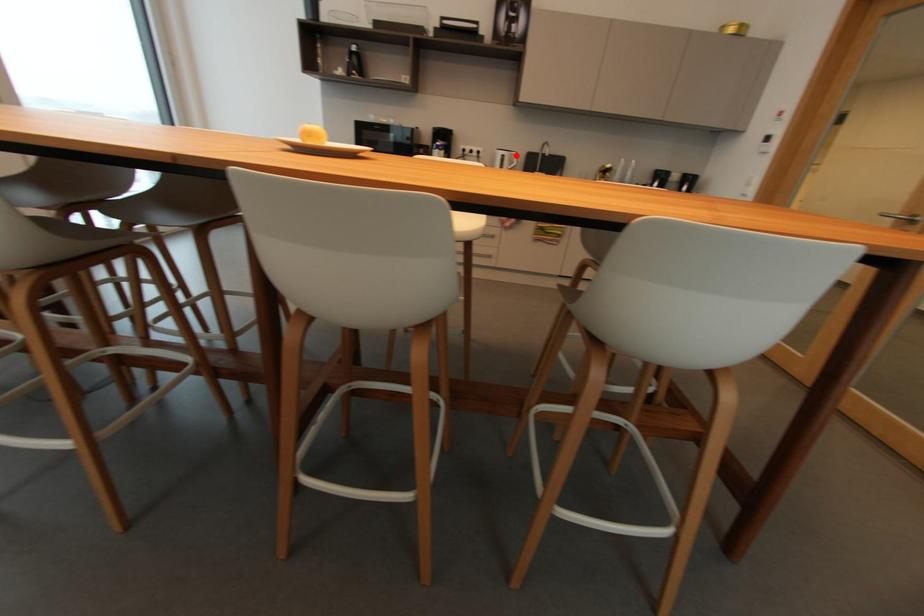
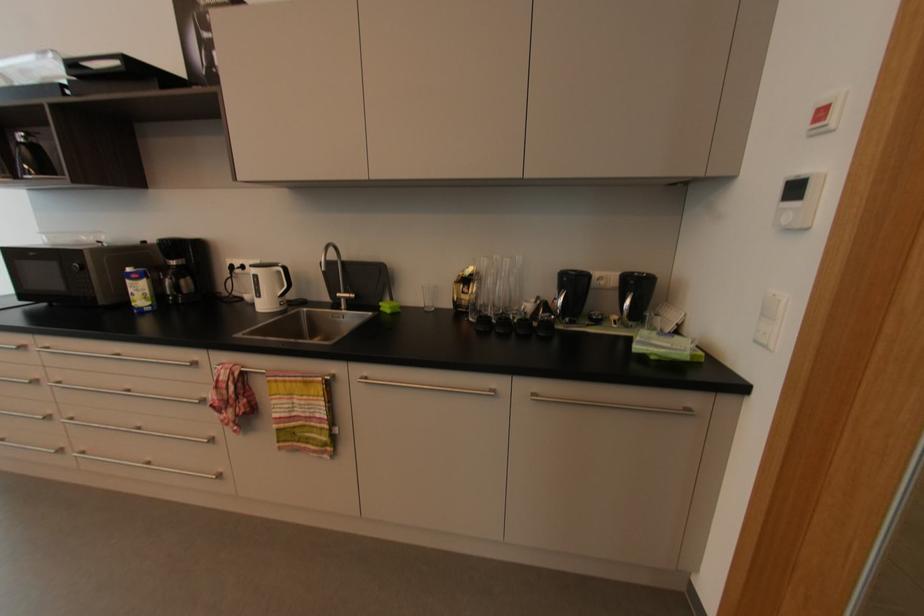
Question: I am providing you with two images of the same scene from different viewpoints. A red point is shown in image1. For the corresponding object point in image2, is it positioned nearer or farther from the camera?

Choices:
 (A) Nearer
 (B) Farther

Answer: (B)